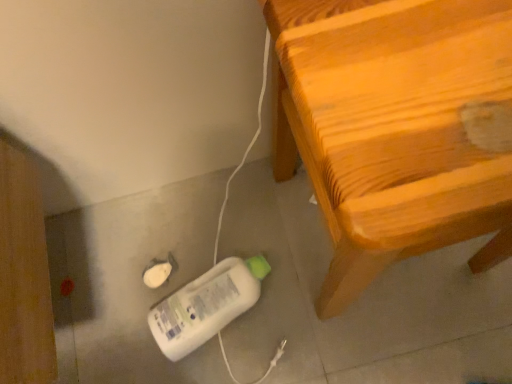
Question: Looking at the image, does wooden chair at right seem bigger or smaller compared to white plastic bottle at lower center?

Choices:
 (A) small
 (B) big

Answer: (B)

Question: From a real-world perspective, relative to white plastic bottle at lower center, is wooden chair at right vertically above or below?

Choices:
 (A) above
 (B) below

Answer: (A)

Question: Is wooden chair at right wider or thinner than white plastic bottle at lower center?

Choices:
 (A) wide
 (B) thin

Answer: (A)

Question: In terms of height, does white plastic bottle at lower center look taller or shorter compared to wooden chair at right?

Choices:
 (A) short
 (B) tall

Answer: (A)

Question: Is white plastic bottle at lower center inside or outside of wooden chair at right?

Choices:
 (A) inside
 (B) outside

Answer: (B)

Question: From a real-world perspective, is white plastic bottle at lower center above or below wooden chair at right?

Choices:
 (A) below
 (B) above

Answer: (A)

Question: Is white plastic bottle at lower center wider or thinner than wooden chair at right?

Choices:
 (A) wide
 (B) thin

Answer: (B)